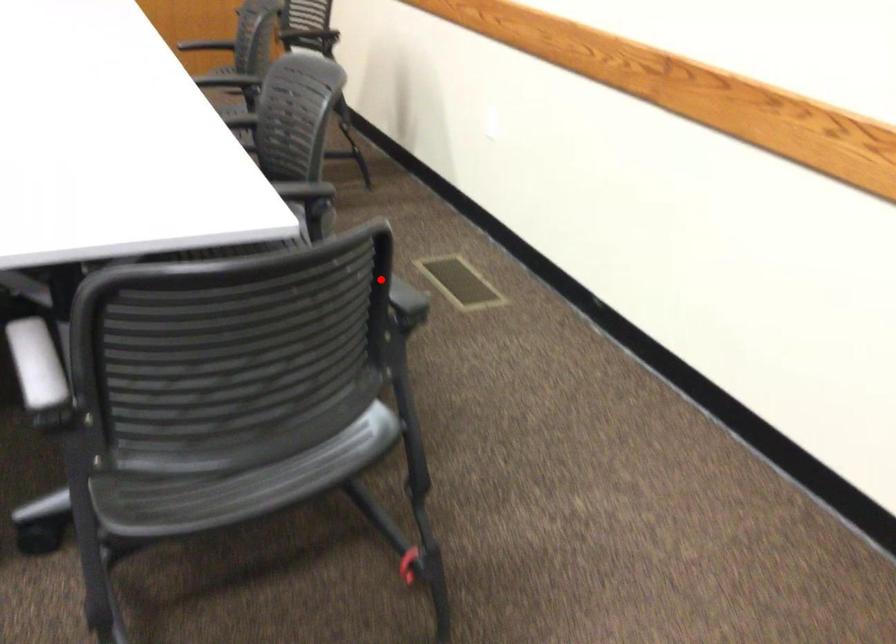
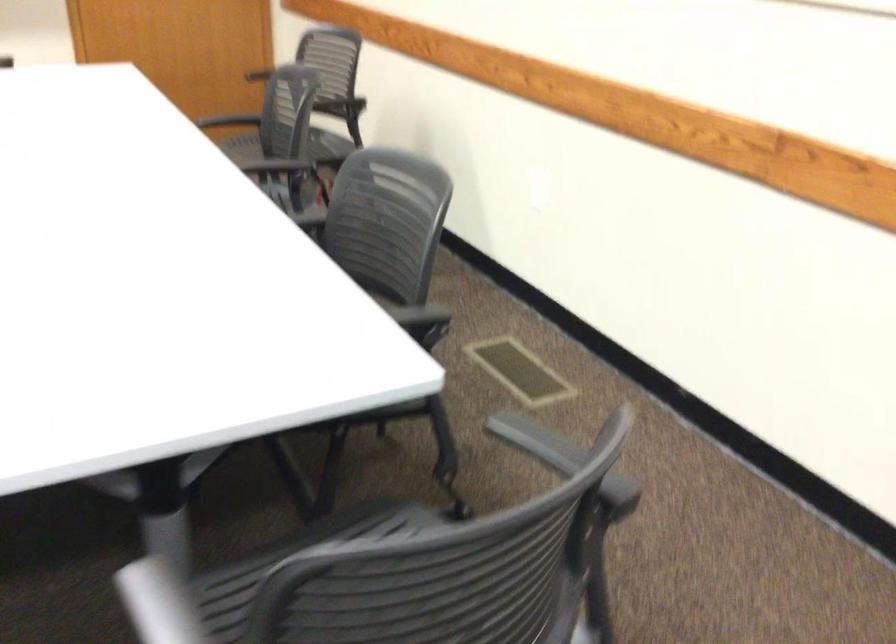
Question: I am providing you with two images of the same scene from different viewpoints. In image1, a red point is highlighted. Considering the same 3D point in image2, which of the following is correct?

Choices:
 (A) It is closer
 (B) It is farther

Answer: (A)